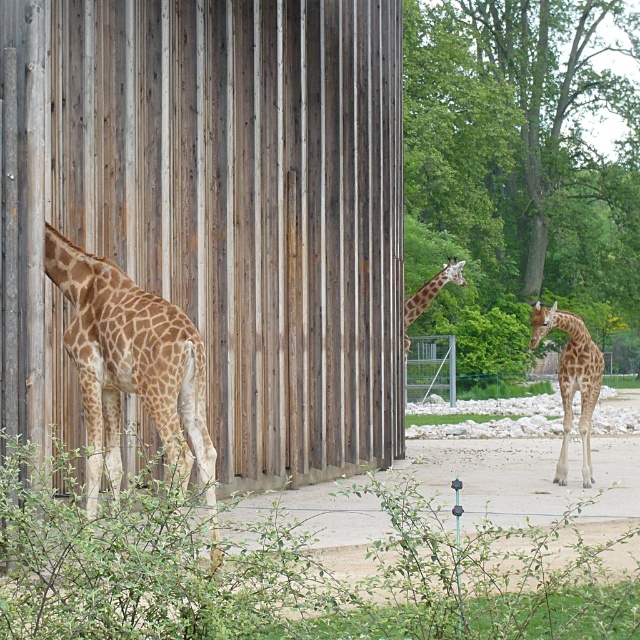
Question: Is spotted fur giraffe at left thinner than spotted fur giraffe at right?

Choices:
 (A) no
 (B) yes

Answer: (B)

Question: Can you confirm if spotted fur giraffe at left is positioned above spotted fur giraffe at right?

Choices:
 (A) no
 (B) yes

Answer: (B)

Question: In this image, where is spotted fur giraffe at left located relative to spotted fur giraffe at right?

Choices:
 (A) right
 (B) left

Answer: (B)

Question: Which point is farther to the camera?

Choices:
 (A) (454, 272)
 (B) (120, 376)
 (C) (561, 324)

Answer: (A)

Question: Which point is farther from the camera taking this photo?

Choices:
 (A) (173, 435)
 (B) (582, 381)
 (C) (464, 262)

Answer: (C)

Question: Which point is closer to the camera taking this photo?

Choices:
 (A) (406, 308)
 (B) (589, 371)
 (C) (115, 317)

Answer: (C)